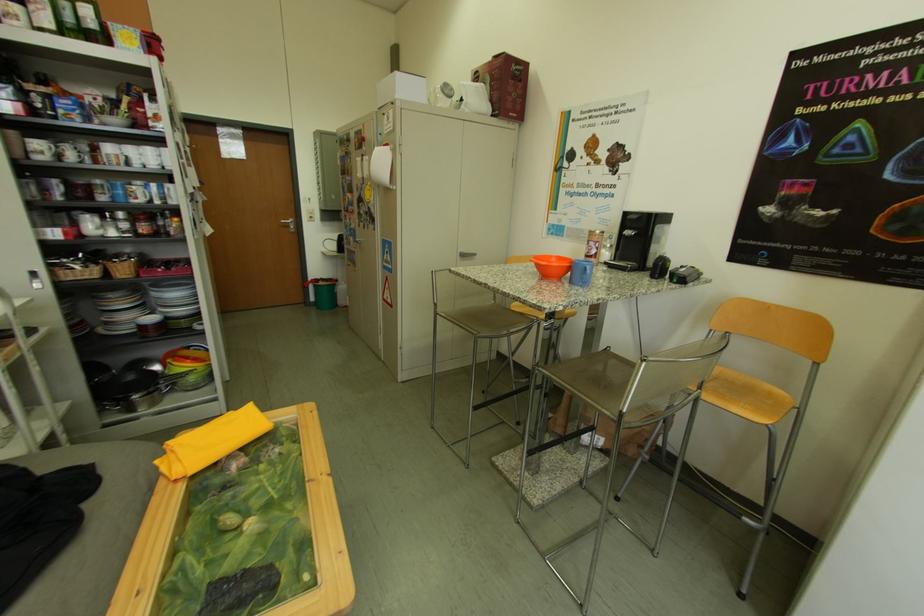
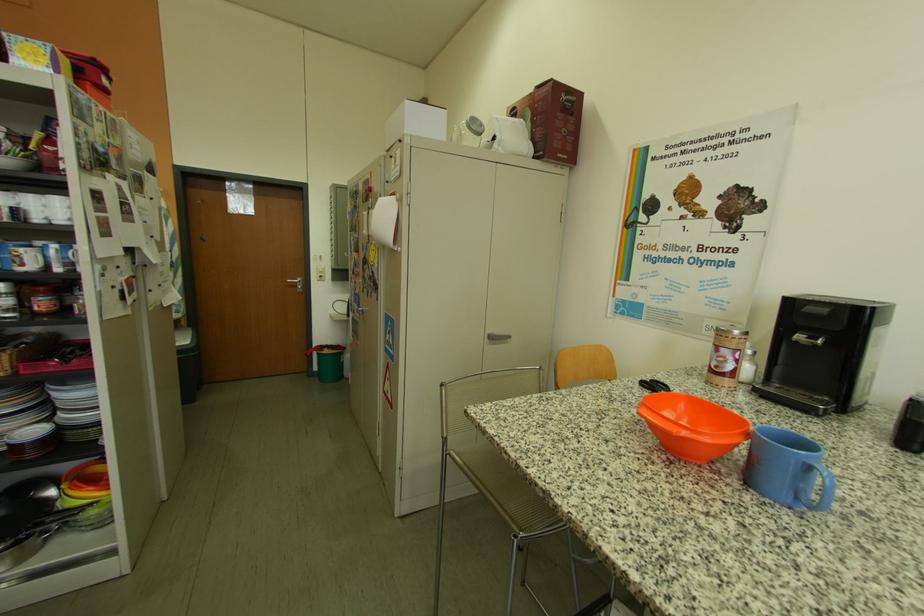
Where in the second image is the point corresponding to (x=609, y=257) from the first image?

(747, 373)